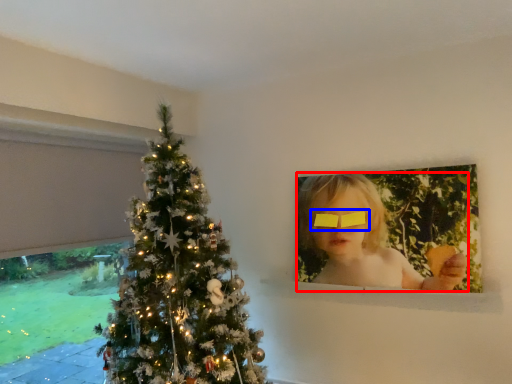
Question: Among these objects, which one is farthest to the camera, girl (highlighted by a red box) or glasses (highlighted by a blue box)?

Choices:
 (A) girl
 (B) glasses

Answer: (B)